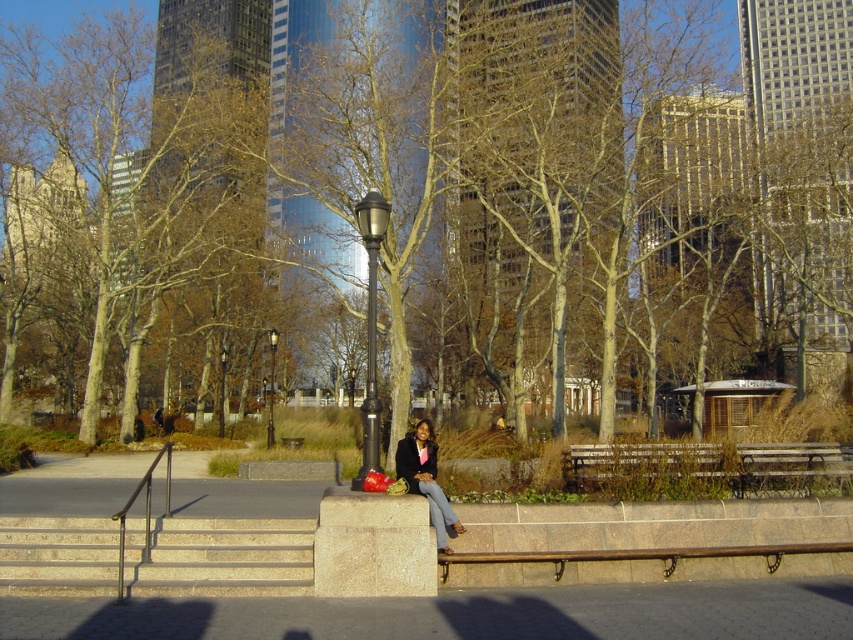
Question: Which point is closer to the camera?

Choices:
 (A) (178, 589)
 (B) (415, 458)
 (C) (282, 156)

Answer: (A)

Question: Where is brown bark tree at center located in relation to beige stone stairs at lower left in the image?

Choices:
 (A) above
 (B) below

Answer: (A)

Question: Is beige stone stairs at lower left smaller than matte black jacket at center?

Choices:
 (A) no
 (B) yes

Answer: (A)

Question: Where is beige stone stairs at lower left located in relation to matte black jacket at center in the image?

Choices:
 (A) left
 (B) right

Answer: (A)

Question: Which of the following is the closest to the observer?

Choices:
 (A) beige stone stairs at lower left
 (B) matte black jacket at center

Answer: (A)

Question: Which point is farther to the camera?

Choices:
 (A) pyautogui.click(x=416, y=438)
 (B) pyautogui.click(x=200, y=586)

Answer: (A)